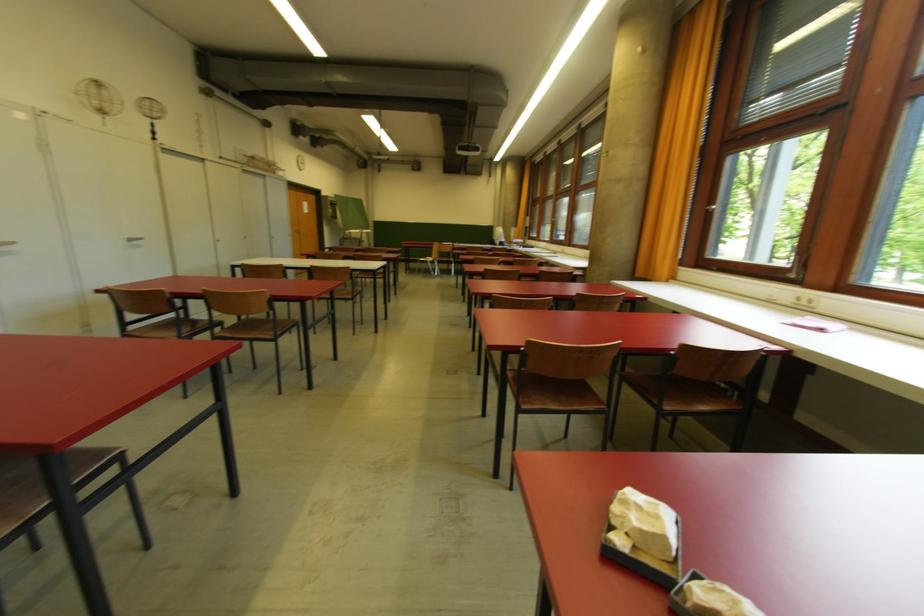
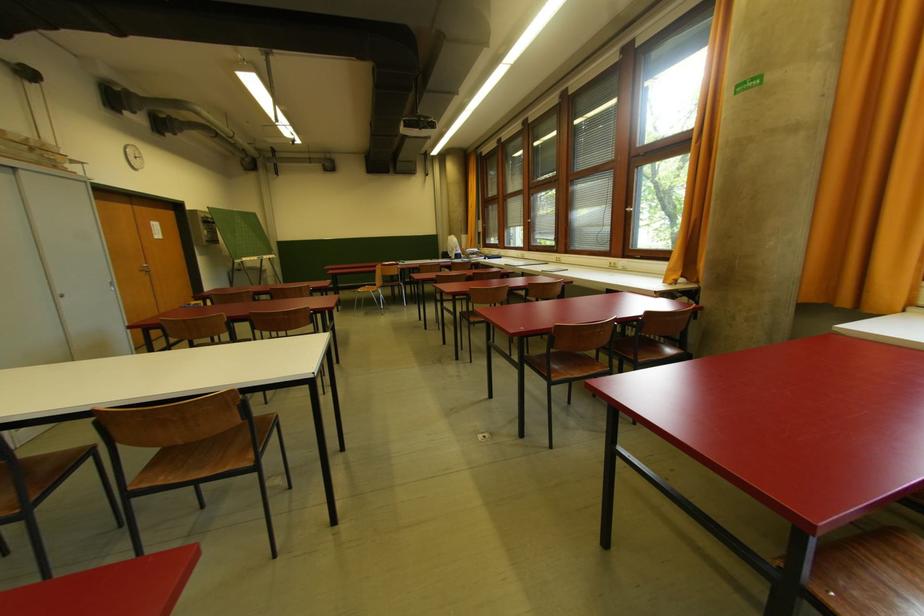
In the second image, find the point that corresponds to the point at 353,299 in the first image.

(250, 467)